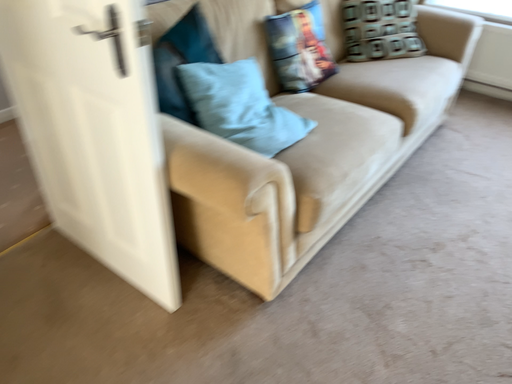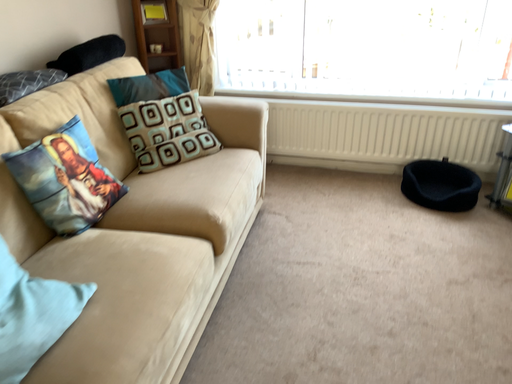
Question: Which way did the camera rotate in the video?

Choices:
 (A) rotated left
 (B) rotated right

Answer: (B)